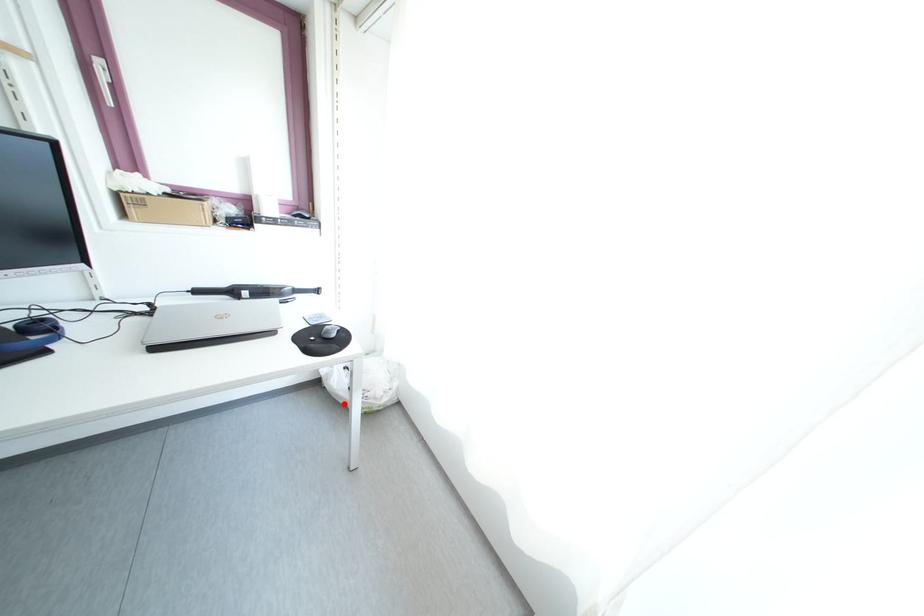
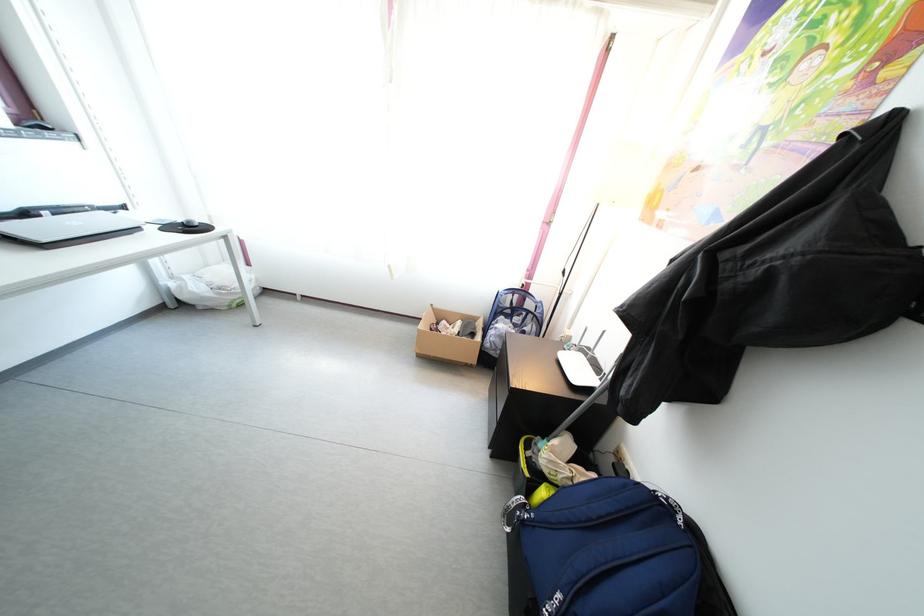
The point at the highlighted location is marked in the first image. Where is the corresponding point in the second image?

(210, 306)